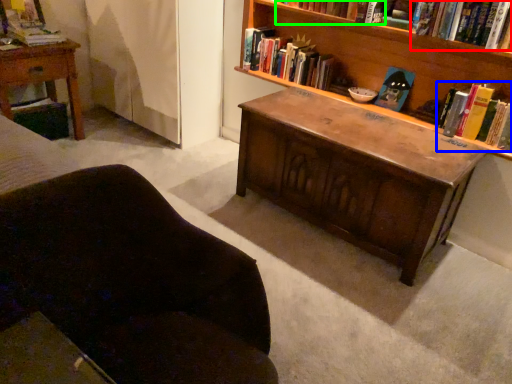
Question: Which is nearer to the book (highlighted by a red box)? book (highlighted by a blue box) or book (highlighted by a green box).

Choices:
 (A) book
 (B) book

Answer: (A)